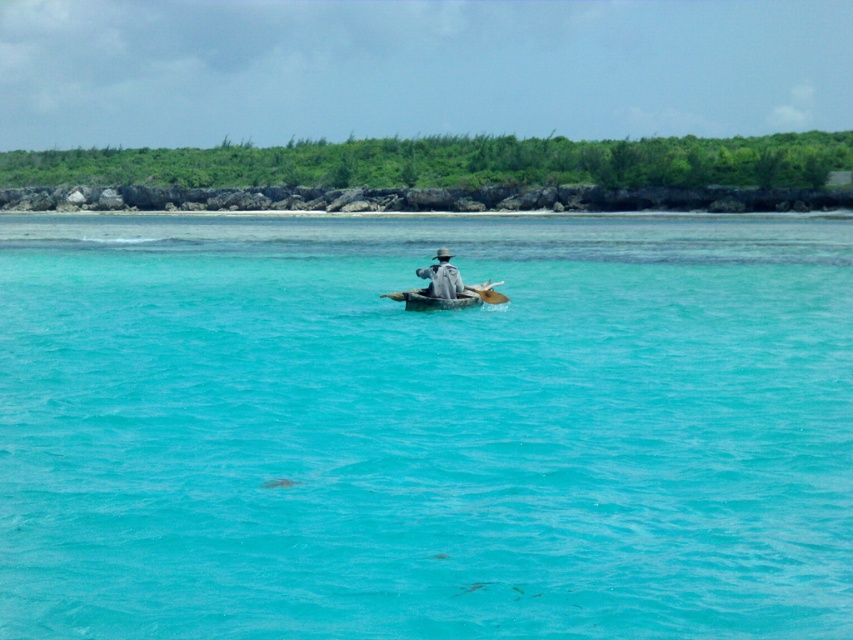
Between turquoise water at center and gray fabric hat at center, which one has less height?

Standing shorter between the two is gray fabric hat at center.

In the scene shown: Can you confirm if turquoise water at center is smaller than gray fabric hat at center?

Actually, turquoise water at center might be larger than gray fabric hat at center.

Describe the element at coordinates (425, 428) in the screenshot. I see `turquoise water at center` at that location.

Locate an element on the screen. turquoise water at center is located at coordinates (425, 428).

Can you confirm if gray fabric hat at center is wider than wooden paddle at center?

Indeed, gray fabric hat at center has a greater width compared to wooden paddle at center.

Which is more to the right, gray fabric hat at center or wooden paddle at center?

Positioned to the right is wooden paddle at center.

The image size is (853, 640). What are the coordinates of `gray fabric hat at center` in the screenshot? It's located at pyautogui.click(x=440, y=276).

At what (x,y) coordinates should I click in order to perform the action: click on gray fabric hat at center. Please return your answer as a coordinate pair (x, y). The width and height of the screenshot is (853, 640). Looking at the image, I should click on (440, 276).

Does turquoise water at center appear over wooden paddle at center?

Correct, turquoise water at center is located above wooden paddle at center.

Can you confirm if turquoise water at center is positioned below wooden paddle at center?

Actually, turquoise water at center is above wooden paddle at center.

Is point (463, 531) positioned after point (469, 289)?

No, it is in front of (469, 289).

This screenshot has width=853, height=640. I want to click on turquoise water at center, so click(x=425, y=428).